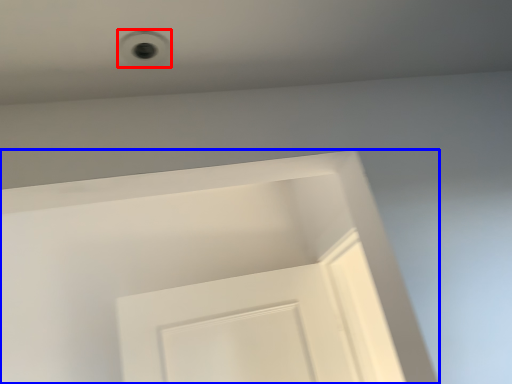
Question: Among these objects, which one is nearest to the camera, hole (highlighted by a red box) or screen door (highlighted by a blue box)?

Choices:
 (A) hole
 (B) screen door

Answer: (A)